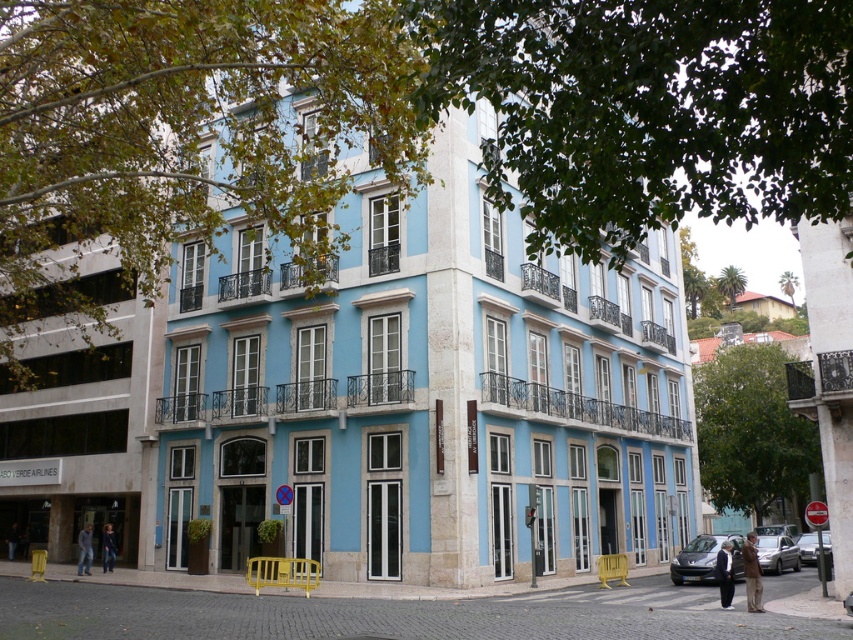
Can you confirm if dark gray suit at lower right is bigger than denim jacket at lower left?

Yes, dark gray suit at lower right is bigger than denim jacket at lower left.

Measure the distance between dark gray suit at lower right and denim jacket at lower left.

The distance of dark gray suit at lower right from denim jacket at lower left is 23.35 meters.

Describe the element at coordinates (724, 573) in the screenshot. This screenshot has height=640, width=853. I see `dark gray suit at lower right` at that location.

You are a GUI agent. You are given a task and a screenshot of the screen. Output one action in this format:
    pyautogui.click(x=<x>, y=<y>)
    Task: Click on the dark gray suit at lower right
    The width and height of the screenshot is (853, 640).
    Given the screenshot: What is the action you would take?
    pyautogui.click(x=724, y=573)

Is point (83, 529) positioned after point (109, 531)?

No, it is in front of (109, 531).

Consider the image. Can you confirm if denim jacket at lower left is smaller than dark blue jeans at lower left?

Result: Indeed, denim jacket at lower left has a smaller size compared to dark blue jeans at lower left.

This screenshot has height=640, width=853. What do you see at coordinates (84, 548) in the screenshot?
I see `denim jacket at lower left` at bounding box center [84, 548].

The width and height of the screenshot is (853, 640). What are the coordinates of `denim jacket at lower left` in the screenshot? It's located at (84, 548).

Is dark gray suit at lower right shorter than dark blue jeans at lower left?

In fact, dark gray suit at lower right may be taller than dark blue jeans at lower left.

Identify the location of dark gray suit at lower right. (724, 573).